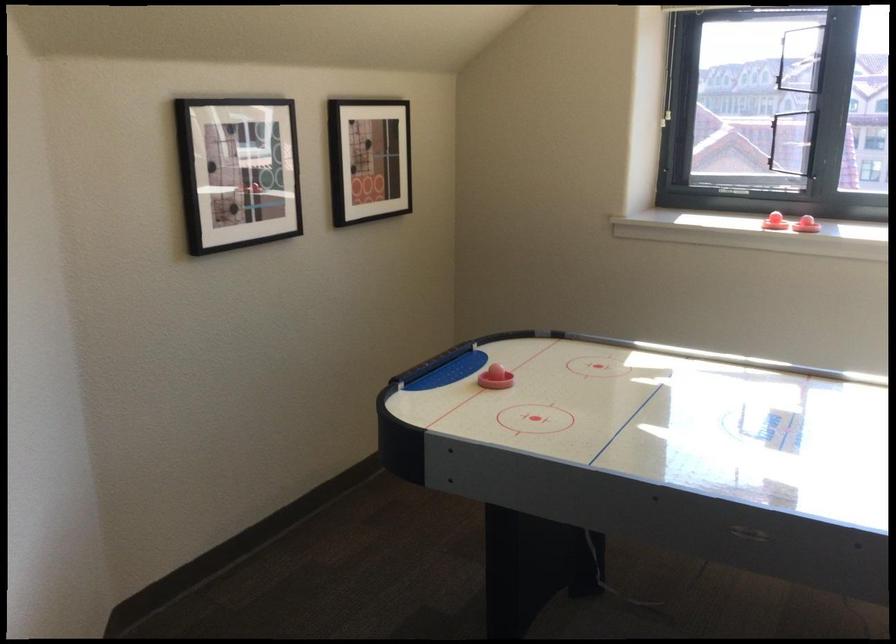
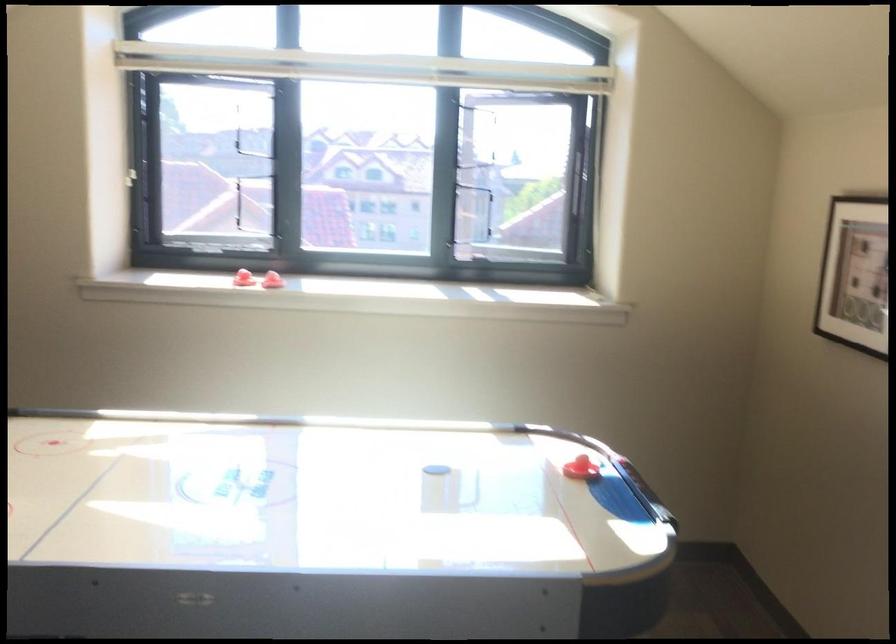
Locate, in the second image, the point that corresponds to pixel 806 216 in the first image.

(271, 279)